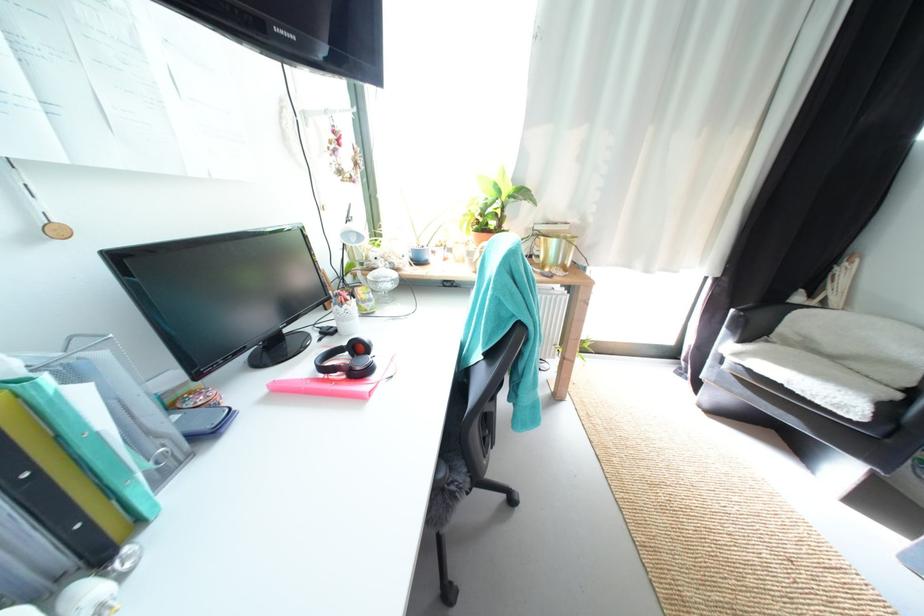
This screenshot has height=616, width=924. I want to click on green binder hole, so click(x=31, y=493).